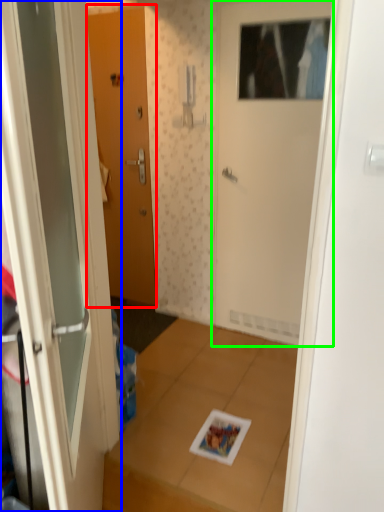
Question: Which is farther away from door (highlighted by a red box)? door (highlighted by a blue box) or door (highlighted by a green box)?

Choices:
 (A) door
 (B) door

Answer: (A)